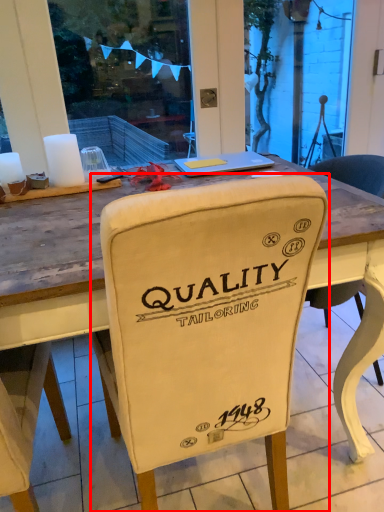
Question: From the image's perspective, where is chair (annotated by the red box) located relative to laptop?

Choices:
 (A) below
 (B) above

Answer: (A)